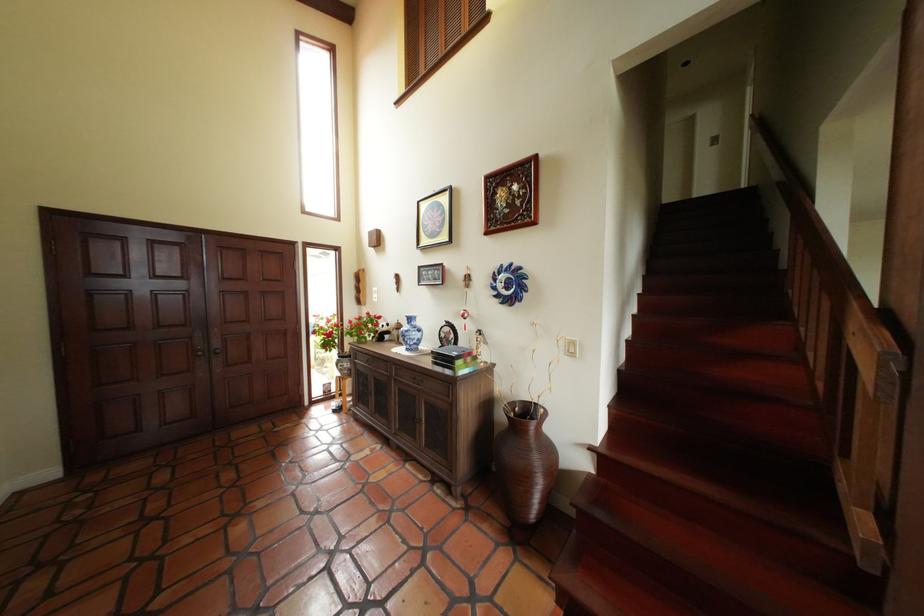
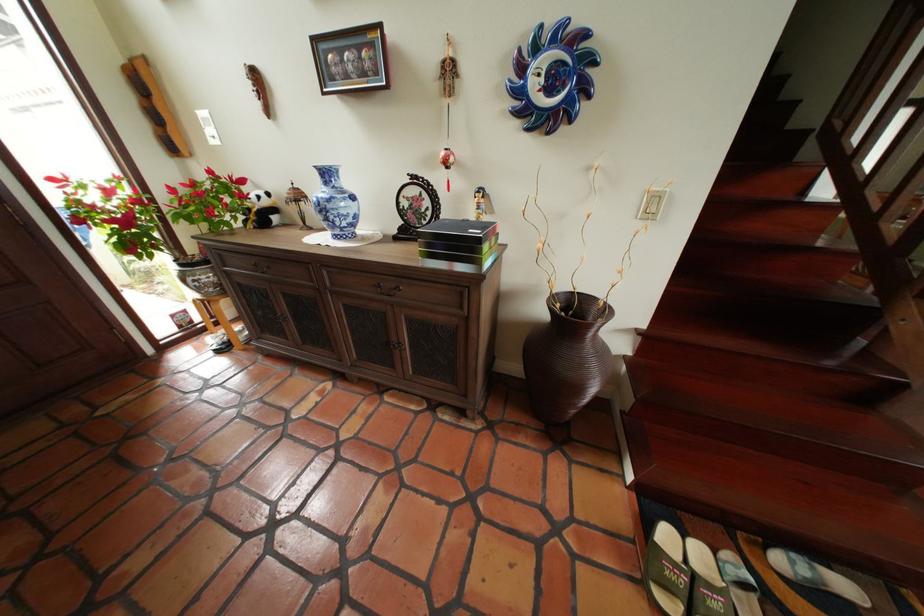
In the second image, find the point that corresponds to pixel 519 289 in the first image.

(563, 91)